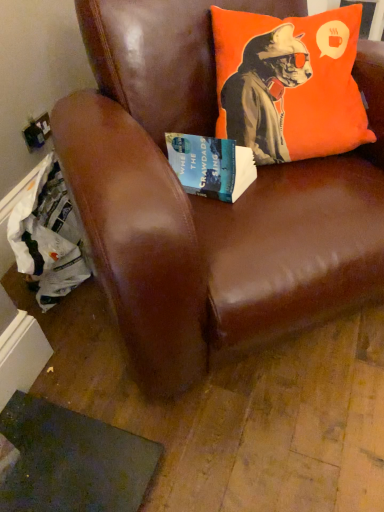
Question: Can you confirm if hardcover book at center is shorter than orange fabric pillow at upper right?

Choices:
 (A) yes
 (B) no

Answer: (A)

Question: Is hardcover book at center in front of orange fabric pillow at upper right?

Choices:
 (A) yes
 (B) no

Answer: (B)

Question: Can you see hardcover book at center touching orange fabric pillow at upper right?

Choices:
 (A) yes
 (B) no

Answer: (B)

Question: Is hardcover book at center wider than orange fabric pillow at upper right?

Choices:
 (A) no
 (B) yes

Answer: (A)

Question: Is hardcover book at center not inside orange fabric pillow at upper right?

Choices:
 (A) yes
 (B) no

Answer: (A)

Question: Does point (251, 28) appear closer or farther from the camera than point (162, 68)?

Choices:
 (A) closer
 (B) farther

Answer: (A)

Question: From the image's perspective, relative to brown leather chair at upper center, is orange fabric pillow at upper right above or below?

Choices:
 (A) above
 (B) below

Answer: (A)

Question: In the image, is orange fabric pillow at upper right positioned in front of or behind brown leather chair at upper center?

Choices:
 (A) behind
 (B) front

Answer: (A)

Question: Based on their sizes in the image, would you say orange fabric pillow at upper right is bigger or smaller than brown leather chair at upper center?

Choices:
 (A) small
 (B) big

Answer: (A)

Question: From the image's perspective, is brown leather chair at upper center above or below orange fabric pillow at upper right?

Choices:
 (A) below
 (B) above

Answer: (A)

Question: Considering the relative positions of brown leather chair at upper center and orange fabric pillow at upper right in the image provided, is brown leather chair at upper center to the left or to the right of orange fabric pillow at upper right?

Choices:
 (A) left
 (B) right

Answer: (A)

Question: In terms of width, does brown leather chair at upper center look wider or thinner when compared to orange fabric pillow at upper right?

Choices:
 (A) thin
 (B) wide

Answer: (B)

Question: Is point (309, 193) closer or farther from the camera than point (226, 105)?

Choices:
 (A) closer
 (B) farther

Answer: (A)

Question: Considering the relative positions of brown leather chair at upper center and hardcover book at center in the image provided, is brown leather chair at upper center to the left or to the right of hardcover book at center?

Choices:
 (A) left
 (B) right

Answer: (B)

Question: Is brown leather chair at upper center taller or shorter than hardcover book at center?

Choices:
 (A) tall
 (B) short

Answer: (A)